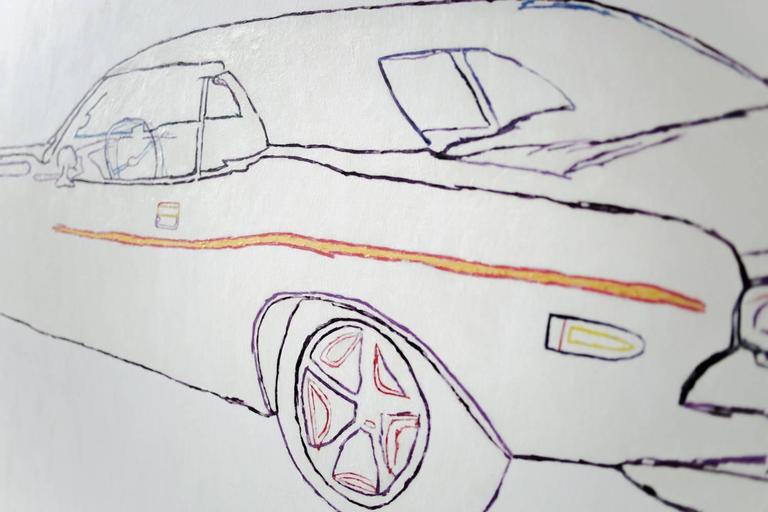
You are a GUI agent. You are given a task and a screenshot of the screen. Output one action in this format:
    pyautogui.click(x=<x>, y=<y>)
    Task: Click on the door handle
    This screenshot has height=512, width=768.
    Given the screenshot: What is the action you would take?
    pyautogui.click(x=159, y=210)